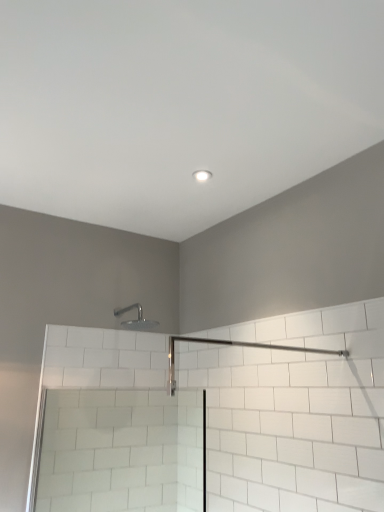
Question: Does silver metallic shower head at upper center have a greater width compared to clear glass screen door at lower left?

Choices:
 (A) yes
 (B) no

Answer: (B)

Question: Is silver metallic shower head at upper center positioned before clear glass screen door at lower left?

Choices:
 (A) yes
 (B) no

Answer: (B)

Question: Can you confirm if silver metallic shower head at upper center is thinner than clear glass screen door at lower left?

Choices:
 (A) no
 (B) yes

Answer: (B)

Question: Is silver metallic shower head at upper center next to clear glass screen door at lower left?

Choices:
 (A) no
 (B) yes

Answer: (A)

Question: Is silver metallic shower head at upper center positioned far away from clear glass screen door at lower left?

Choices:
 (A) no
 (B) yes

Answer: (A)

Question: Considering their positions, is white glossy light fixture at upper center located in front of or behind clear glass screen door at lower left?

Choices:
 (A) behind
 (B) front

Answer: (A)

Question: Is white glossy light fixture at upper center situated inside clear glass screen door at lower left or outside?

Choices:
 (A) outside
 (B) inside

Answer: (A)

Question: In terms of width, does white glossy light fixture at upper center look wider or thinner when compared to clear glass screen door at lower left?

Choices:
 (A) wide
 (B) thin

Answer: (B)

Question: Based on their sizes in the image, would you say white glossy light fixture at upper center is bigger or smaller than clear glass screen door at lower left?

Choices:
 (A) big
 (B) small

Answer: (B)

Question: Considering the positions of silver metallic shower head at upper center and white glossy light fixture at upper center in the image, is silver metallic shower head at upper center taller or shorter than white glossy light fixture at upper center?

Choices:
 (A) tall
 (B) short

Answer: (A)

Question: Would you say silver metallic shower head at upper center is inside or outside white glossy light fixture at upper center?

Choices:
 (A) inside
 (B) outside

Answer: (B)

Question: Is silver metallic shower head at upper center wider or thinner than white glossy light fixture at upper center?

Choices:
 (A) thin
 (B) wide

Answer: (B)

Question: Considering their positions, is silver metallic shower head at upper center located in front of or behind white glossy light fixture at upper center?

Choices:
 (A) behind
 (B) front

Answer: (A)

Question: In the image, is clear glass screen door at lower left positioned in front of or behind silver metallic shower head at upper center?

Choices:
 (A) front
 (B) behind

Answer: (A)

Question: In terms of height, does clear glass screen door at lower left look taller or shorter compared to silver metallic shower head at upper center?

Choices:
 (A) tall
 (B) short

Answer: (A)